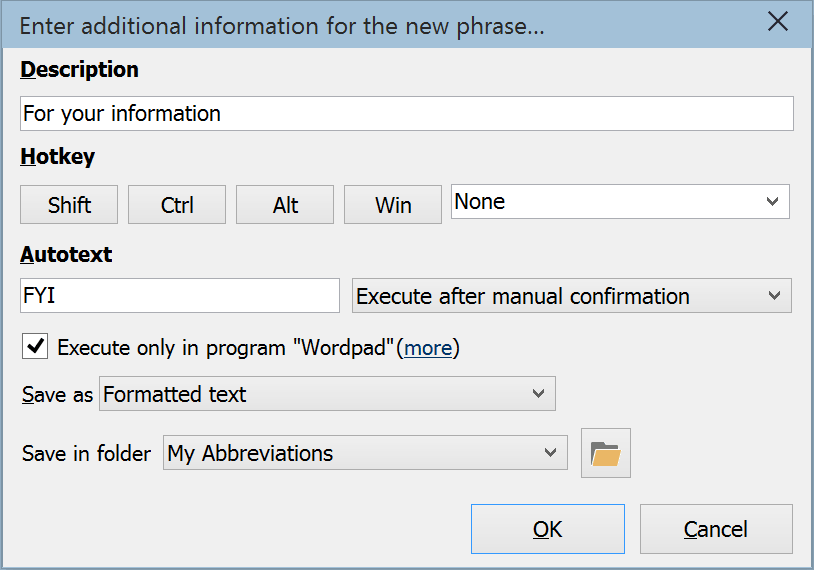
Where is `file folder`? file folder is located at coordinates (593, 437).